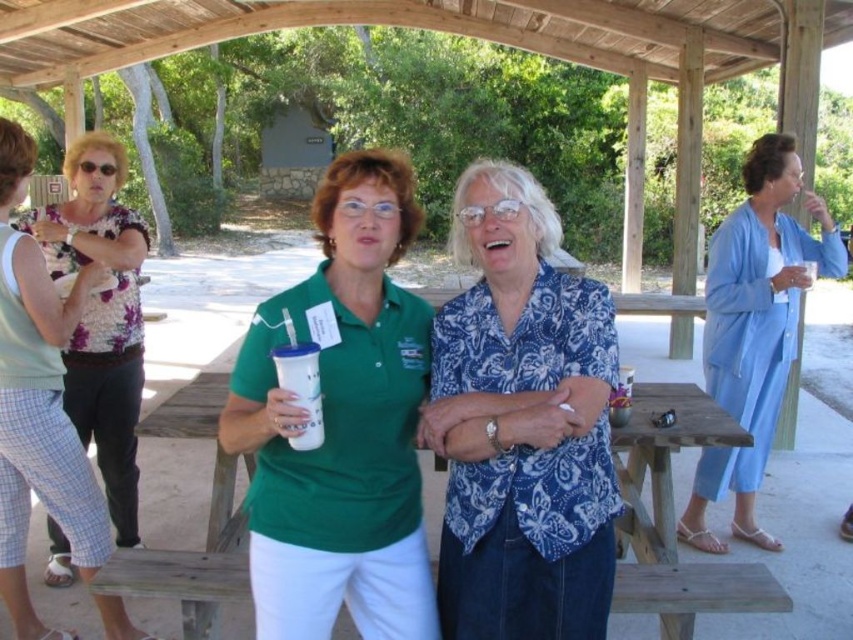
Which is behind, point (199, 392) or point (6, 163)?

The point (199, 392) is behind.

This screenshot has width=853, height=640. Describe the element at coordinates (672, 516) in the screenshot. I see `wooden picnic table at center` at that location.

I want to click on wooden picnic table at center, so click(x=672, y=516).

Which is behind, point (189, 636) or point (708, 548)?

The point (708, 548) is behind.

Is point (635, 452) closer to camera compared to point (787, 362)?

Yes, point (635, 452) is closer to viewer.

Is point (631, 529) closer to viewer compared to point (764, 298)?

Yes, point (631, 529) is closer to viewer.

At what (x,y) coordinates should I click in order to perform the action: click on wooden picnic table at center. Please return your answer as a coordinate pair (x, y). The width and height of the screenshot is (853, 640). Looking at the image, I should click on (672, 516).

Identify the location of light blue fabric dress at right. This screenshot has height=640, width=853. (753, 328).

Can you confirm if light blue fabric dress at right is wider than floral print blouse at left?

Yes, light blue fabric dress at right is wider than floral print blouse at left.

Is point (747, 236) more distant than point (10, 337)?

Yes, it is behind point (10, 337).

The image size is (853, 640). I want to click on light blue fabric dress at right, so click(x=753, y=328).